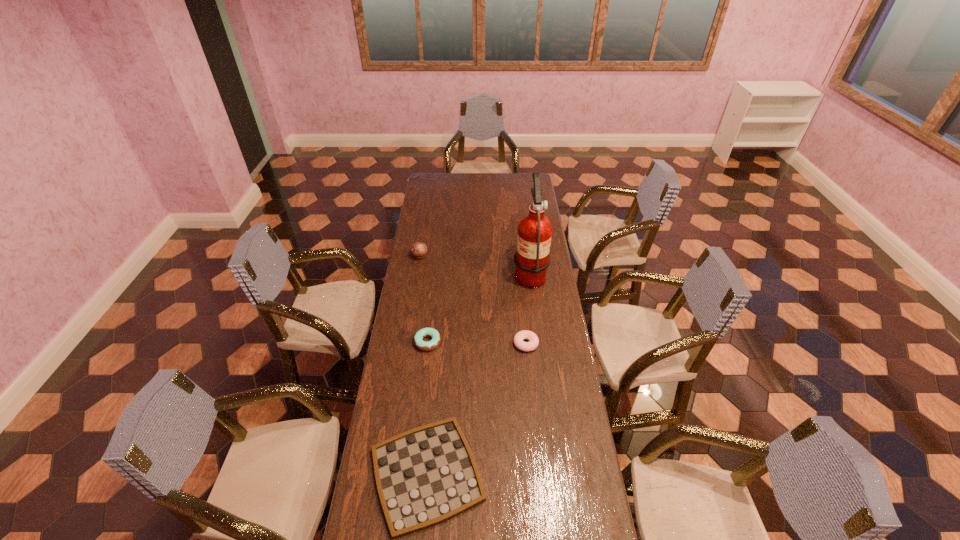
Where is `free point between the muffin and the nearest object`? Image resolution: width=960 pixels, height=540 pixels. free point between the muffin and the nearest object is located at coordinates coord(423,365).

The height and width of the screenshot is (540, 960). In order to click on object that is the third closest to the left doughnut in this screenshot , I will do `click(532, 258)`.

Select which object is the closest to the left doughnut. Please provide its 2D coordinates. Your answer should be formatted as a tuple, i.e. [(x, y)], where the tuple contains the x and y coordinates of a point satisfying the conditions above.

[(518, 339)]

Identify the location of free space that satisfies the following two spatial constraints: 1. on the back side of the right doughnut; 2. on the right side of the checkerboard. The image size is (960, 540). (439, 343).